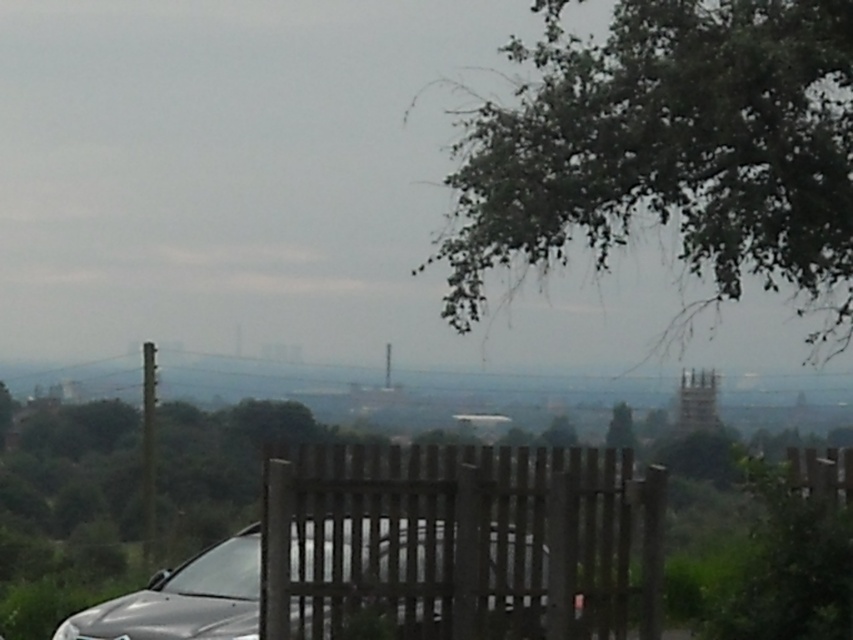
How distant is green leafy tree at upper right from white plastic license plate at center?

green leafy tree at upper right and white plastic license plate at center are 5.55 meters apart from each other.

Find the location of a particular element. The image size is (853, 640). green leafy tree at upper right is located at coordinates (670, 154).

Which is in front, point (561, 634) or point (78, 636)?

Positioned in front is point (561, 634).

Where is `brown wooden fence at center`? This screenshot has height=640, width=853. brown wooden fence at center is located at coordinates (457, 540).

Which is more to the left, brown wooden fence at center or satin silver car at center?

satin silver car at center

Does brown wooden fence at center have a lesser height compared to satin silver car at center?

No, brown wooden fence at center is not shorter than satin silver car at center.

Who is more forward, (456, 531) or (433, 525)?

Point (433, 525)

At what (x,y) coordinates should I click in order to perform the action: click on brown wooden fence at center. Please return your answer as a coordinate pair (x, y). Looking at the image, I should click on (457, 540).